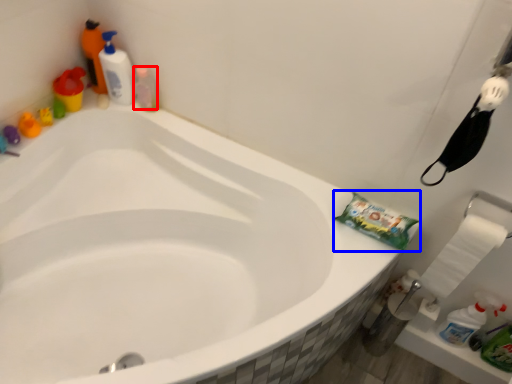
Question: Which of the following is the farthest to the observer, cleaning product (highlighted by a red box) or material (highlighted by a blue box)?

Choices:
 (A) cleaning product
 (B) material

Answer: (A)